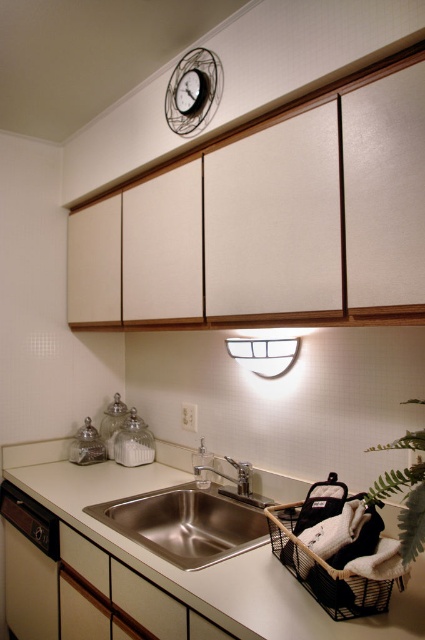
You are standing at the center of the kitchen. Where is the green leafy plant at lower right in relation to your position?

The green leafy plant at lower right is located at point 0.772 on the x axis and 0.953 on the y axis, which is to the lower right of your position.

You are a kitchen designer planning to install a new under cabinet light. You see the stainless steel sink at center and the metallic wire clock at upper center. Which object is located below the other?

The stainless steel sink at center is positioned under the metallic wire clock at upper center, meaning the sink is below the clock.

You are a kitchen designer planning to install a new undercounter appliance in the space between the stainless steel sink at center and the metallic wire clock at upper center. Given that the appliance requires 30 cm of vertical space, can you confirm if there is enough space between these two objects?

The stainless steel sink at center is larger in size than the metallic wire clock at upper center, but the exact vertical distance between them isn t specified. Without knowing the actual spacing, it s impossible to determine if 30 cm is available.